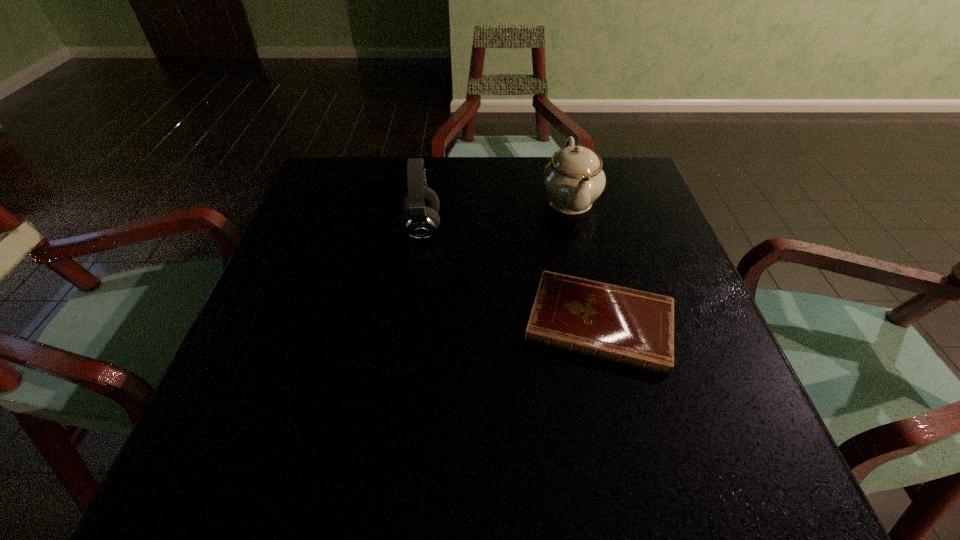
Image resolution: width=960 pixels, height=540 pixels. What are the coordinates of `free region that satisfies the following two spatial constraints: 1. at the spout of the chinaware; 2. on the ear cups of the leftmost object` in the screenshot? It's located at pos(576,228).

At what (x,y) coordinates should I click in order to perform the action: click on blank space that satisfies the following two spatial constraints: 1. on the ear cups of the headset; 2. on the right side of the shortest object. Please return your answer as a coordinate pair (x, y). The height and width of the screenshot is (540, 960). Looking at the image, I should click on (409, 323).

Identify the location of free spot that satisfies the following two spatial constraints: 1. at the spout of the nearest object; 2. on the right side of the chinaware. (598, 323).

Locate an element on the screen. free space that satisfies the following two spatial constraints: 1. at the spout of the nearest object; 2. on the left side of the chinaware is located at coordinates (598, 323).